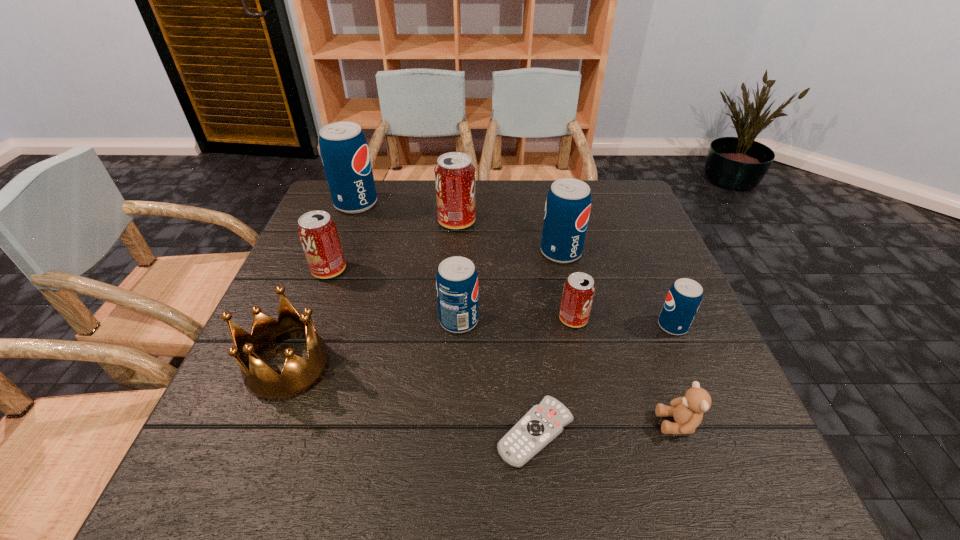
Where is `free space located on the back of the second biggest red soda can`? This screenshot has height=540, width=960. free space located on the back of the second biggest red soda can is located at coordinates (349, 218).

Find the location of `vacant space located on the right of the third biggest blue pop`. vacant space located on the right of the third biggest blue pop is located at coordinates [582, 321].

Where is `free space located 0.310m on the right of the crown`? This screenshot has height=540, width=960. free space located 0.310m on the right of the crown is located at coordinates (482, 367).

Identify the location of vacant region located on the right of the rightmost red soda can. The image size is (960, 540). (633, 319).

The image size is (960, 540). What are the coordinates of `free space located 0.180m on the front of the rightmost blue pop` in the screenshot? It's located at (709, 412).

In order to click on vacant space located 0.220m on the face of the teddy bear in this screenshot , I will do `click(536, 423)`.

At what (x,y) coordinates should I click in order to perform the action: click on vacant space located 0.150m on the face of the teddy bear. Please return your answer as a coordinate pair (x, y). The width and height of the screenshot is (960, 540). Looking at the image, I should click on (575, 423).

Locate an element on the screen. The image size is (960, 540). vacant space positioned on the face of the teddy bear is located at coordinates (459, 423).

Find the location of `vacant space located on the back of the shortest object`. vacant space located on the back of the shortest object is located at coordinates (530, 377).

I want to click on object at the near edge, so click(542, 423).